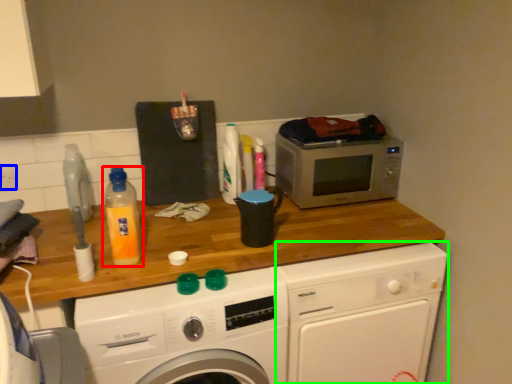
Question: Which is farther away from bottle (highlighted by a red box)? power plugs and sockets (highlighted by a blue box) or washing machine (highlighted by a green box)?

Choices:
 (A) power plugs and sockets
 (B) washing machine

Answer: (B)